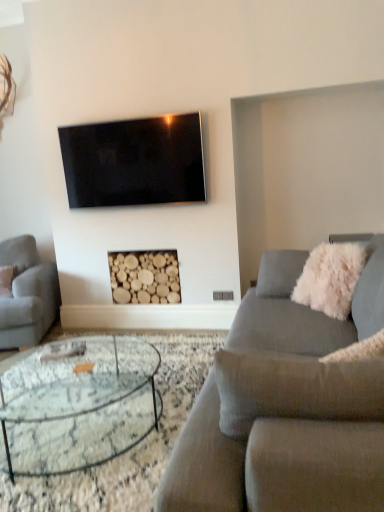
The height and width of the screenshot is (512, 384). I want to click on clear glass coffee table at center, so click(x=77, y=406).

Describe the element at coordinates (77, 406) in the screenshot. I see `clear glass coffee table at center` at that location.

The width and height of the screenshot is (384, 512). What do you see at coordinates (286, 407) in the screenshot? I see `textured gray couch at center, which is counted as the 1th studio couch, starting from the front` at bounding box center [286, 407].

This screenshot has height=512, width=384. What do you see at coordinates (331, 277) in the screenshot? I see `white fluffy pillow at right` at bounding box center [331, 277].

Where is `natural wood logs at center`? The height and width of the screenshot is (512, 384). natural wood logs at center is located at coordinates (145, 277).

Which object is wider, light gray fabric couch at left, arranged as the 2th studio couch when viewed from the front, or natural wood logs at center?

light gray fabric couch at left, arranged as the 2th studio couch when viewed from the front.

In the scene shown: Does light gray fabric couch at left, which is the 1th studio couch in left-to-right order, turn towards natural wood logs at center?

No.

Who is taller, light gray fabric couch at left, marked as the second studio couch in a right-to-left arrangement, or natural wood logs at center?

With more height is light gray fabric couch at left, marked as the second studio couch in a right-to-left arrangement.

Between light gray fabric couch at left, the first studio couch when ordered from back to front, and natural wood logs at center, which one appears on the right side from the viewer's perspective?

natural wood logs at center is more to the right.

Considering the sizes of white fluffy pillow at right and clear glass coffee table at center in the image, is white fluffy pillow at right bigger or smaller than clear glass coffee table at center?

Considering their sizes, white fluffy pillow at right takes up less space than clear glass coffee table at center.

Which is nearer, (355, 261) or (49, 392)?

Clearly, point (355, 261) is closer to the camera than point (49, 392).

From a real-world perspective, is white fluffy pillow at right physically above clear glass coffee table at center?

Yes.

Is white fluffy pillow at right oriented towards textured gray couch at center, which is the first studio couch in right-to-left order?

Yes, white fluffy pillow at right is oriented towards textured gray couch at center, which is the first studio couch in right-to-left order.

From a real-world perspective, which object stands above the other?

From a 3D spatial view, white fluffy pillow at right is above.

From a real-world perspective, who is located higher, clear glass coffee table at center or white fluffy pillow at right?

white fluffy pillow at right is physically above.

Which of these two, clear glass coffee table at center or white fluffy pillow at right, stands shorter?

Standing shorter between the two is clear glass coffee table at center.

Considering the relative positions of clear glass coffee table at center and white fluffy pillow at right in the image provided, is clear glass coffee table at center to the left or to the right of white fluffy pillow at right?

Based on their positions, clear glass coffee table at center is located to the left of white fluffy pillow at right.

Does clear glass coffee table at center have a smaller size compared to white fluffy pillow at right?

No, clear glass coffee table at center is not smaller than white fluffy pillow at right.

Which object is positioned more to the left, black glossy tv at upper center or textured gray couch at center, acting as the 2th studio couch starting from the left?

Positioned to the left is black glossy tv at upper center.

How different are the orientations of black glossy tv at upper center and textured gray couch at center, acting as the 2th studio couch starting from the left, in degrees?

91.1 degrees separate the facing orientations of black glossy tv at upper center and textured gray couch at center, acting as the 2th studio couch starting from the left.

From a real-world perspective, who is located lower, black glossy tv at upper center or textured gray couch at center, which is the first studio couch in right-to-left order?

From a 3D spatial view, textured gray couch at center, which is the first studio couch in right-to-left order, is below.

From a real-world perspective, does clear glass coffee table at center sit lower than black glossy tv at upper center?

Yes.

Based on the photo, does clear glass coffee table at center turn towards black glossy tv at upper center?

No, clear glass coffee table at center is not facing towards black glossy tv at upper center.

Which of these two, clear glass coffee table at center or black glossy tv at upper center, is smaller?

With smaller size is black glossy tv at upper center.

Image resolution: width=384 pixels, height=512 pixels. Identify the location of the 2nd studio couch below the natural wood logs at center (from the image's perspective). coord(286,407).

From a real-world perspective, which object rests below the other?

From a 3D spatial view, textured gray couch at center, acting as the 2th studio couch starting from the left, is below.

Which is correct: textured gray couch at center, which is counted as the second studio couch, starting from the back, is inside natural wood logs at center, or outside of it?

textured gray couch at center, which is counted as the second studio couch, starting from the back, is not enclosed by natural wood logs at center.

This screenshot has height=512, width=384. There is a natural wood logs at center. What are the coordinates of `the 1st studio couch below it (from the image's perspective)` in the screenshot? It's located at (27, 294).

This screenshot has height=512, width=384. Find the location of `pillow on the right of clear glass coffee table at center`. pillow on the right of clear glass coffee table at center is located at coordinates (331, 277).

When comparing their distances from black glossy tv at upper center, does clear glass coffee table at center or natural wood logs at center seem closer?

natural wood logs at center is closer to black glossy tv at upper center.

Based on their spatial positions, is light gray fabric couch at left, marked as the second studio couch in a right-to-left arrangement, or black glossy tv at upper center further from natural wood logs at center?

The object further to natural wood logs at center is light gray fabric couch at left, marked as the second studio couch in a right-to-left arrangement.

When comparing their distances from white fluffy pillow at right, does light gray fabric couch at left, marked as the second studio couch in a right-to-left arrangement, or natural wood logs at center seem further?

Based on the image, light gray fabric couch at left, marked as the second studio couch in a right-to-left arrangement, appears to be further to white fluffy pillow at right.

When comparing their distances from clear glass coffee table at center, does white fluffy pillow at right or textured gray couch at center, which is counted as the 1th studio couch, starting from the front, seem closer?

The object closer to clear glass coffee table at center is textured gray couch at center, which is counted as the 1th studio couch, starting from the front.

From the image, which object appears to be farther from clear glass coffee table at center, black glossy tv at upper center or white fluffy pillow at right?

black glossy tv at upper center is further to clear glass coffee table at center.

When comparing their distances from white fluffy pillow at right, does clear glass coffee table at center or black glossy tv at upper center seem further?

Based on the image, black glossy tv at upper center appears to be further to white fluffy pillow at right.

Based on their spatial positions, is textured gray couch at center, which is the first studio couch in right-to-left order, or clear glass coffee table at center closer to white fluffy pillow at right?

textured gray couch at center, which is the first studio couch in right-to-left order.

Estimate the real-world distances between objects in this image. Which object is closer to textured gray couch at center, which is counted as the 1th studio couch, starting from the front, white fluffy pillow at right or clear glass coffee table at center?

clear glass coffee table at center.

Locate an element on the screen. The height and width of the screenshot is (512, 384). studio couch between clear glass coffee table at center and black glossy tv at upper center along the z-axis is located at coordinates (27, 294).

You are a GUI agent. You are given a task and a screenshot of the screen. Output one action in this format:
    pyautogui.click(x=<x>, y=<y>)
    Task: Click on the coffee table between textured gray couch at center, which is the first studio couch in right-to-left order, and light gray fabric couch at left, the first studio couch when ordered from back to front, along the z-axis
    The height and width of the screenshot is (512, 384).
    Given the screenshot: What is the action you would take?
    pyautogui.click(x=77, y=406)

Find the location of a particular element. Image resolution: width=384 pixels, height=512 pixels. television between clear glass coffee table at center and natural wood logs at center from front to back is located at coordinates (134, 162).

Where is `coffee table positioned between textured gray couch at center, acting as the 2th studio couch starting from the left, and black glossy tv at upper center from near to far`? coffee table positioned between textured gray couch at center, acting as the 2th studio couch starting from the left, and black glossy tv at upper center from near to far is located at coordinates (77, 406).